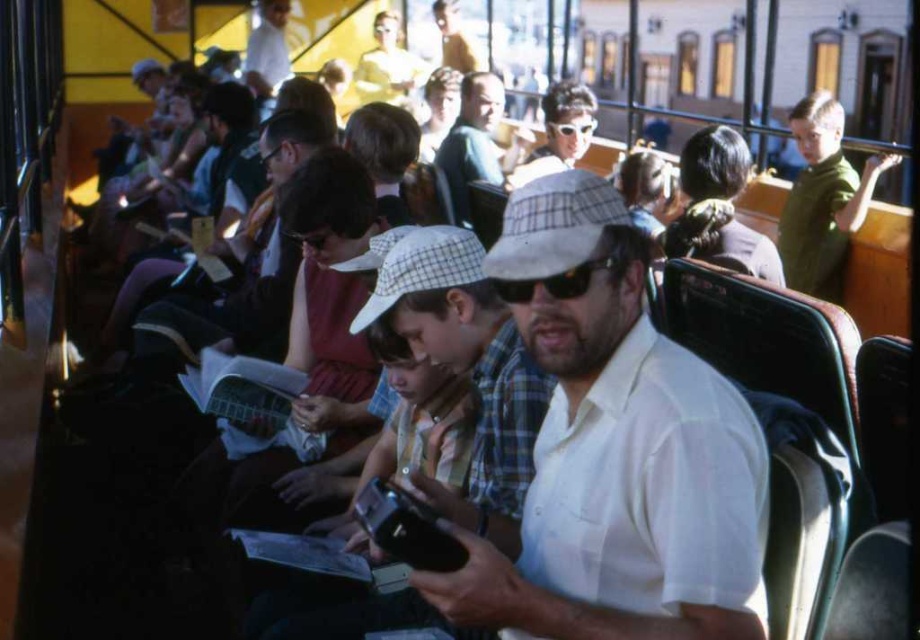
Who is more forward, (733, 611) or (513, 138)?

Point (733, 611) is in front.

Looking at this image, is white cotton shirt at center below matte white hat at center?

Yes, white cotton shirt at center is below matte white hat at center.

You are a GUI agent. You are given a task and a screenshot of the screen. Output one action in this format:
    pyautogui.click(x=<x>, y=<y>)
    Task: Click on the white cotton shirt at center
    The height and width of the screenshot is (640, 920).
    Given the screenshot: What is the action you would take?
    pyautogui.click(x=613, y=456)

Locate an element on the screen. white cotton shirt at center is located at coordinates (613, 456).

Does white checkered baseball hat at center have a lesser width compared to white checkered baseball cap at center?

Correct, white checkered baseball hat at center's width is less than white checkered baseball cap at center's.

Can you confirm if white checkered baseball hat at center is wider than white checkered baseball cap at center?

No.

Which is behind, point (501, 221) or point (386, 253)?

Point (501, 221)

Image resolution: width=920 pixels, height=640 pixels. I want to click on white checkered baseball hat at center, so click(553, 225).

From the picture: Can you confirm if matte black book at center is positioned to the right of white cotton shirt at upper center?

Indeed, matte black book at center is positioned on the right side of white cotton shirt at upper center.

Between matte black book at center and white cotton shirt at upper center, which one is positioned higher?

white cotton shirt at upper center is higher up.

Find the location of `matte black book at center`. matte black book at center is located at coordinates (227, 304).